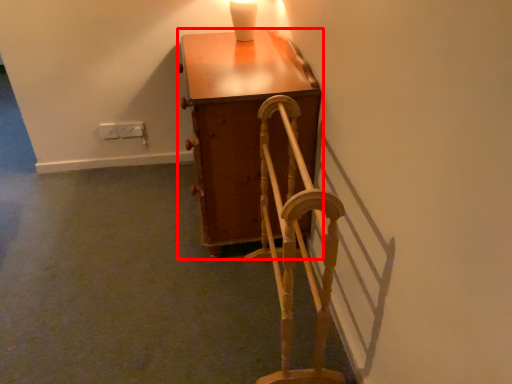
Question: From the image's perspective, what is the correct spatial positioning of furniture (annotated by the red box) in reference to rocking chair?

Choices:
 (A) below
 (B) above

Answer: (B)